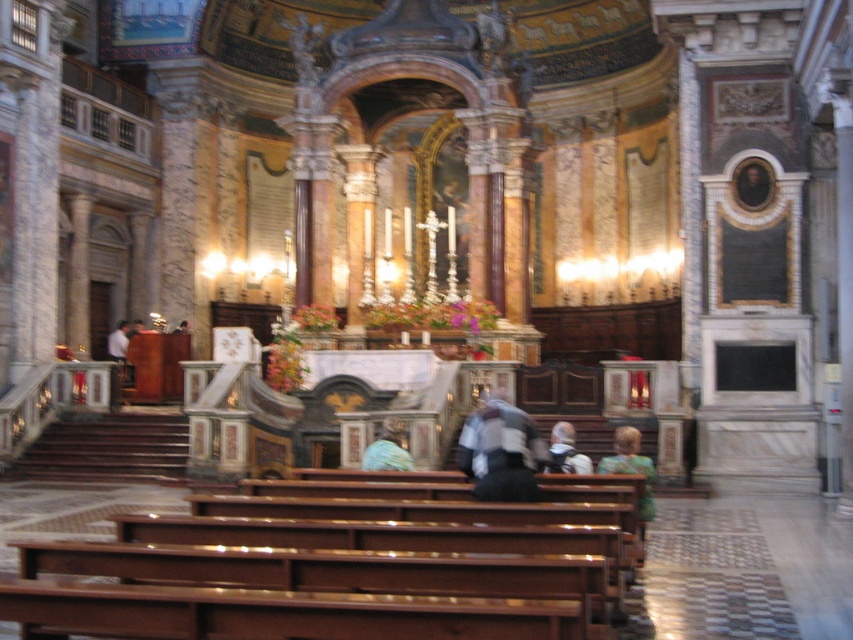
Question: Among these objects, which one is nearest to the camera?

Choices:
 (A) white fabric shirt at left
 (B) green textured sweater at lower center

Answer: (B)

Question: Can you confirm if green textured sweater at lower center is bigger than white fabric shirt at left?

Choices:
 (A) no
 (B) yes

Answer: (B)

Question: Which of the following is the farthest from the observer?

Choices:
 (A) white fabric shirt at left
 (B) light blue fabric at center
 (C) light brown leather jacket at lower center
 (D) green textured sweater at lower center

Answer: (A)

Question: Which point is farther from the camera taking this photo?

Choices:
 (A) (569, 470)
 (B) (115, 358)

Answer: (B)

Question: Does light brown leather jacket at lower center appear over white fabric shirt at left?

Choices:
 (A) no
 (B) yes

Answer: (A)

Question: Can you confirm if green textured sweater at lower center is wider than light brown leather jacket at lower center?

Choices:
 (A) yes
 (B) no

Answer: (A)